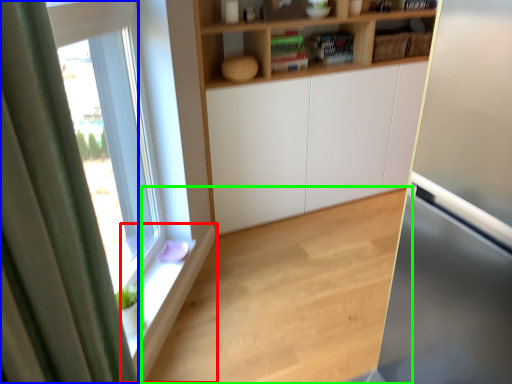
Question: Based on their relative distances, which object is farther from window sill (highlighted by a red box)? Choose from curtain (highlighted by a blue box) and hardwood (highlighted by a green box).

Choices:
 (A) curtain
 (B) hardwood

Answer: (A)